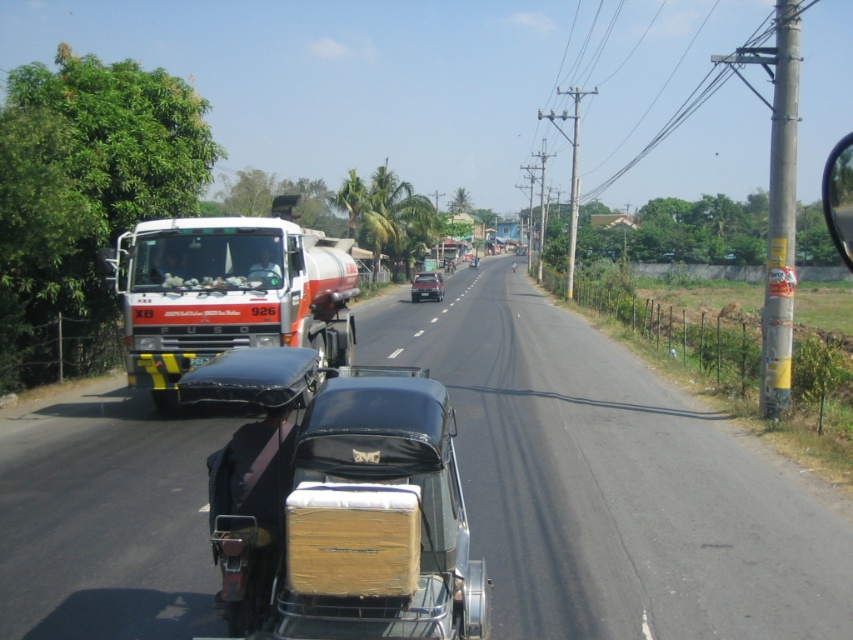
Question: Is shiny silver sedan at center bigger than shiny black sedan at center?

Choices:
 (A) yes
 (B) no

Answer: (B)

Question: Can you confirm if white glossy fuel tanker at left is thinner than shiny silver sedan at center?

Choices:
 (A) yes
 (B) no

Answer: (B)

Question: In this image, where is matte black car at center located relative to white glossy fuel tanker at left?

Choices:
 (A) left
 (B) right

Answer: (B)

Question: Which object appears farthest from the camera in this image?

Choices:
 (A) white glossy fuel tanker at left
 (B) shiny black sedan at center

Answer: (B)

Question: Which point is closer to the camera?

Choices:
 (A) matte black car at center
 (B) shiny black sedan at center
 (C) white glossy fuel tanker at left

Answer: (A)

Question: Which of the following is the closest to the observer?

Choices:
 (A) (316, 248)
 (B) (300, 388)
 (C) (438, 273)
 (D) (471, 268)

Answer: (B)